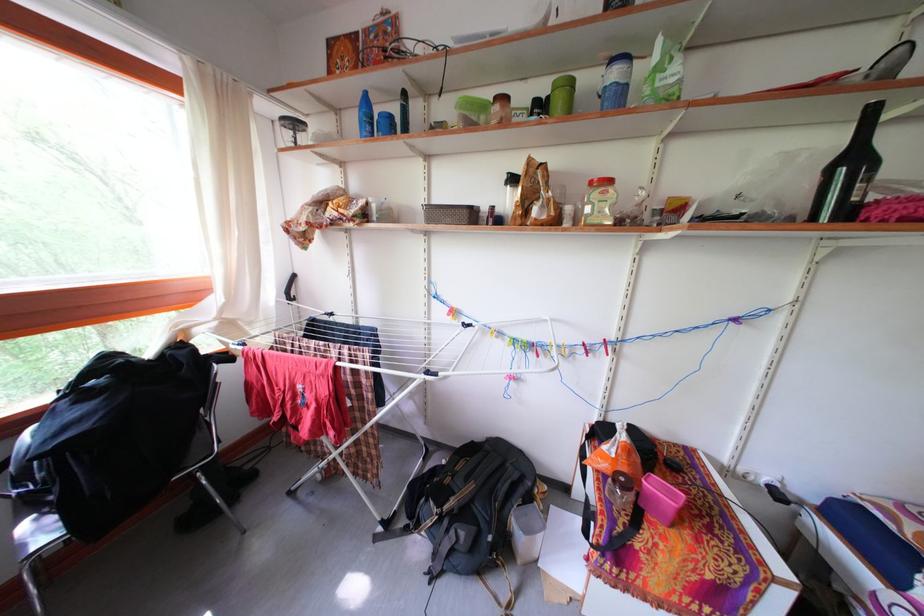
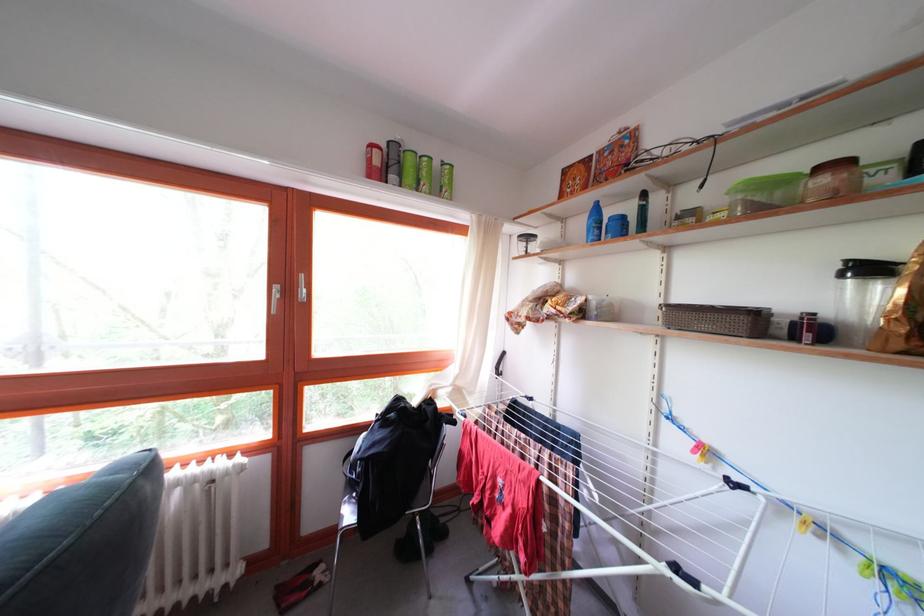
Find the pixel in the second image that matches the point at 517,180 in the first image.

(855, 267)